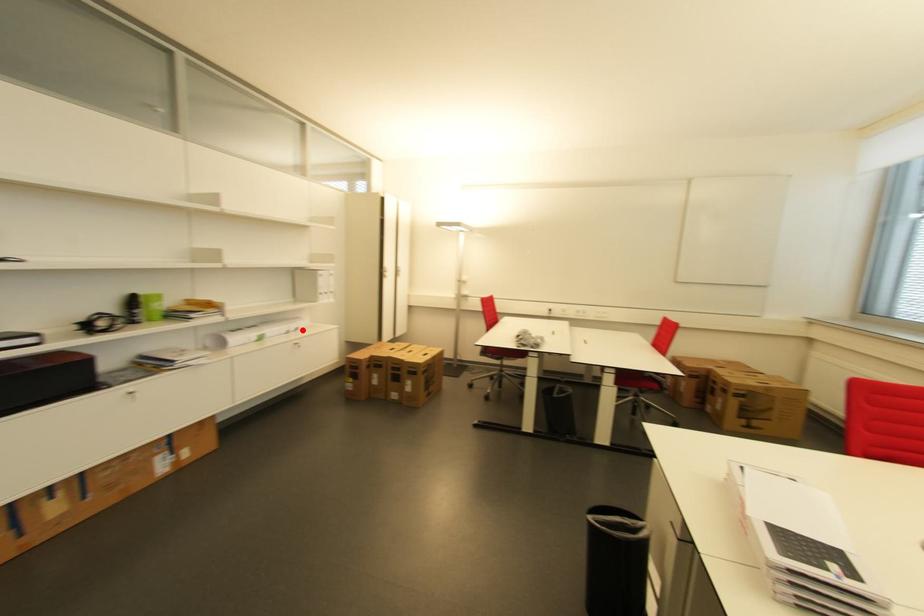
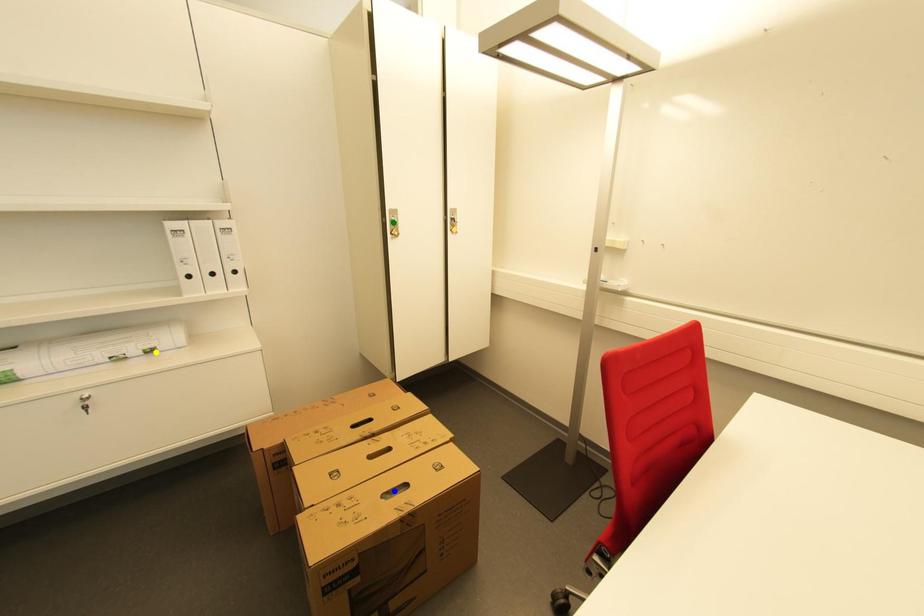
Question: I am providing you with two images of the same scene from different viewpoints. A red point is marked on the first image. You are given multiple points on the second image. Which spot in image 2 lines up with the point in image 1?

Choices:
 (A) blue point
 (B) yellow point
 (C) green point

Answer: (B)